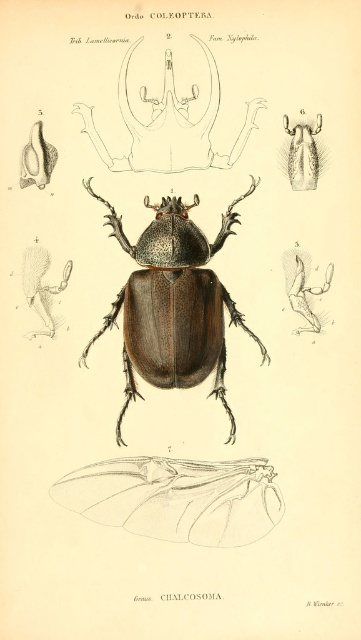
Between matte brown beetle at center and fuzzy brown wing at upper center, which one is positioned higher?

fuzzy brown wing at upper center

Consider the image. Can you confirm if matte brown beetle at center is wider than fuzzy brown wing at upper center?

Yes, matte brown beetle at center is wider than fuzzy brown wing at upper center.

Which is behind, point (219, 312) or point (306, 138)?

Positioned behind is point (219, 312).

At what (x,y) coordinates should I click in order to perform the action: click on matte brown beetle at center. Please return your answer as a coordinate pair (x, y). This screenshot has width=361, height=640. Looking at the image, I should click on (172, 304).

Who is more distant from viewer, (227, 163) or (289, 163)?

The point (227, 163) is behind.

Consider the image. Can you confirm if matte black mandibles at upper center is bigger than fuzzy brown wing at upper center?

Indeed, matte black mandibles at upper center has a larger size compared to fuzzy brown wing at upper center.

Who is more distant from viewer, [176,44] or [289,172]?

The point [289,172] is behind.

The width and height of the screenshot is (361, 640). I want to click on matte black mandibles at upper center, so click(168, 109).

Does point (264, 348) come in front of point (141, 108)?

No.

Which of these two, matte brown beetle at center or matte black mandibles at upper center, stands shorter?

matte black mandibles at upper center is shorter.

Is point (188, 344) positioned after point (175, 148)?

No.

Where is `matte brown beetle at center`? matte brown beetle at center is located at coordinates (172, 304).